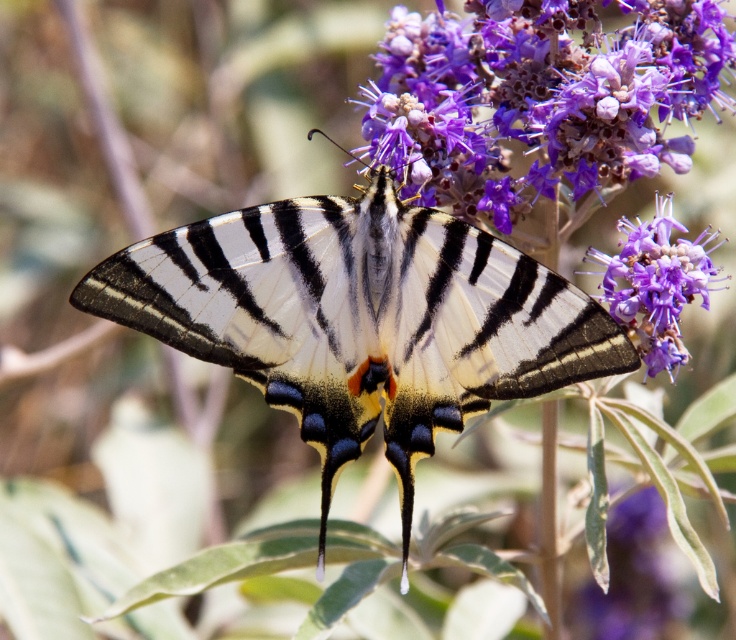
You are an entomologist observing the shiny metallic butterfly at center and the purple fuzzy flower at center. Which object is located to the left of the other?

The shiny metallic butterfly at center is positioned on the left side of purple fuzzy flower at center.